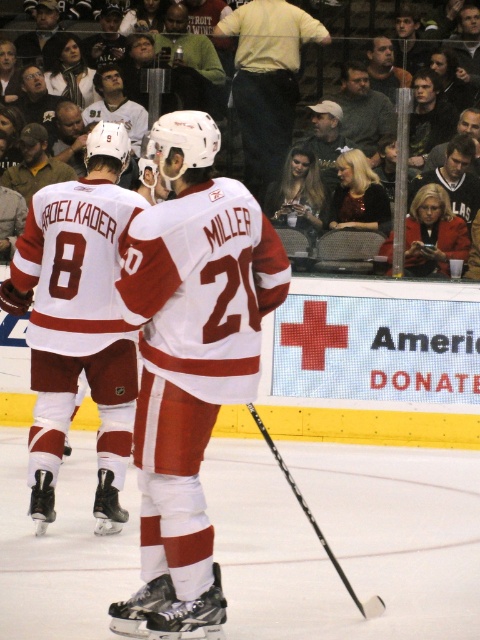
Is white jersey at center above white matte jersey at center?

Incorrect, white jersey at center is not positioned above white matte jersey at center.

Can you confirm if white jersey at center is wider than white matte jersey at center?

No.

Is point (175, 429) closer to viewer compared to point (75, 282)?

Yes, it is.

What are the coordinates of `white jersey at center` in the screenshot? It's located at (191, 356).

Does point (72, 305) come closer to viewer compared to point (312, 513)?

No, (72, 305) is further to viewer.

Can you confirm if white matte jersey at center is smaller than black matte hockey stick at center?

Incorrect, white matte jersey at center is not smaller in size than black matte hockey stick at center.

Which is in front, point (60, 296) or point (303, 499)?

Point (60, 296)

Locate an element on the screen. white matte jersey at center is located at coordinates click(x=78, y=321).

Is white jersey at center thinner than black matte hockey stick at center?

Incorrect, white jersey at center's width is not less than black matte hockey stick at center's.

Which is more to the left, white jersey at center or black matte hockey stick at center?

white jersey at center is more to the left.

Between point (156, 289) and point (325, 541), which one is positioned in front?

Point (156, 289)

Identify the location of white jersey at center. Image resolution: width=480 pixels, height=640 pixels. (191, 356).